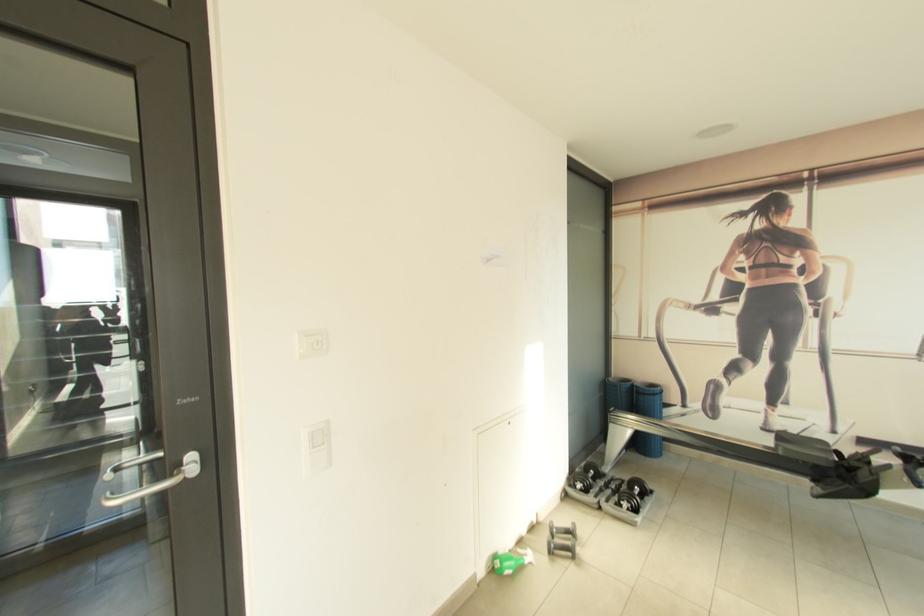
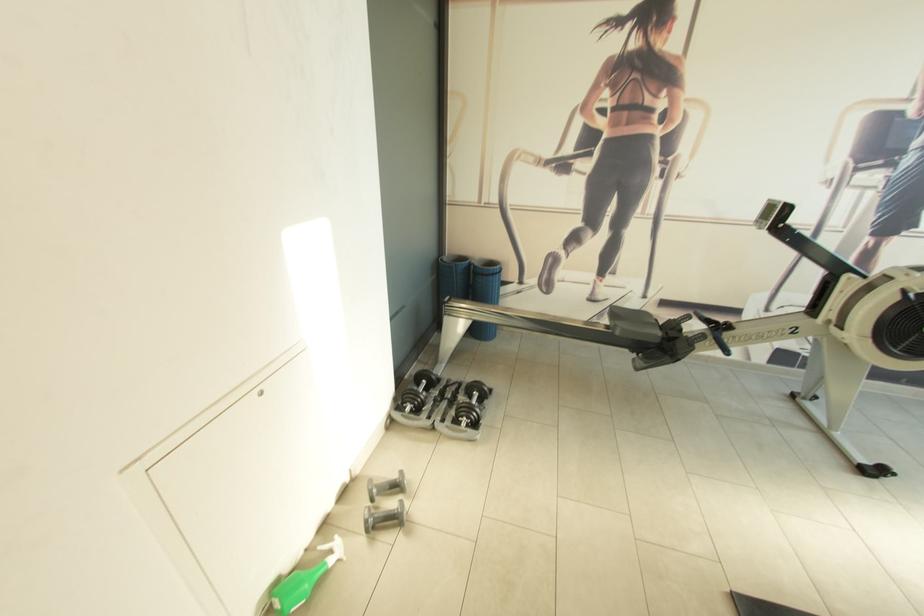
The point at (592, 483) is marked in the first image. Where is the corresponding point in the second image?

(424, 402)